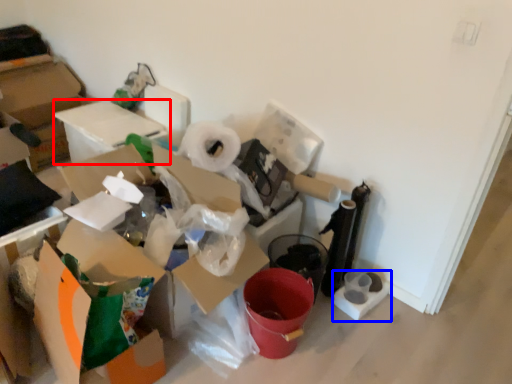
Question: Which of the following is the closest to the observer, cardboard box (highlighted by a red box) or toilet paper (highlighted by a blue box)?

Choices:
 (A) cardboard box
 (B) toilet paper

Answer: (B)